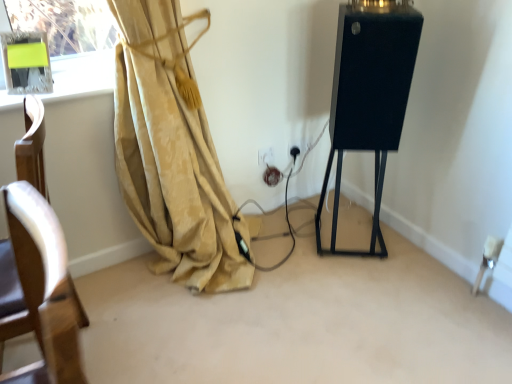
Question: Based on their positions, is white plastic electric outlet at lower center located to the left or right of black fabric speaker at right?

Choices:
 (A) left
 (B) right

Answer: (A)

Question: Considering the positions of point (260, 158) and point (365, 8), is point (260, 158) closer or farther from the camera than point (365, 8)?

Choices:
 (A) closer
 (B) farther

Answer: (B)

Question: From the image's perspective, is white plastic electric outlet at lower center positioned above or below black fabric speaker at right?

Choices:
 (A) above
 (B) below

Answer: (B)

Question: Is black fabric speaker at right in front of or behind white plastic electric outlet at lower center in the image?

Choices:
 (A) front
 (B) behind

Answer: (A)

Question: From the image's perspective, is black fabric speaker at right located above or below white plastic electric outlet at lower center?

Choices:
 (A) below
 (B) above

Answer: (B)

Question: Is black fabric speaker at right wider or thinner than white plastic electric outlet at lower center?

Choices:
 (A) thin
 (B) wide

Answer: (B)

Question: From their relative heights in the image, would you say black fabric speaker at right is taller or shorter than white plastic electric outlet at lower center?

Choices:
 (A) short
 (B) tall

Answer: (B)